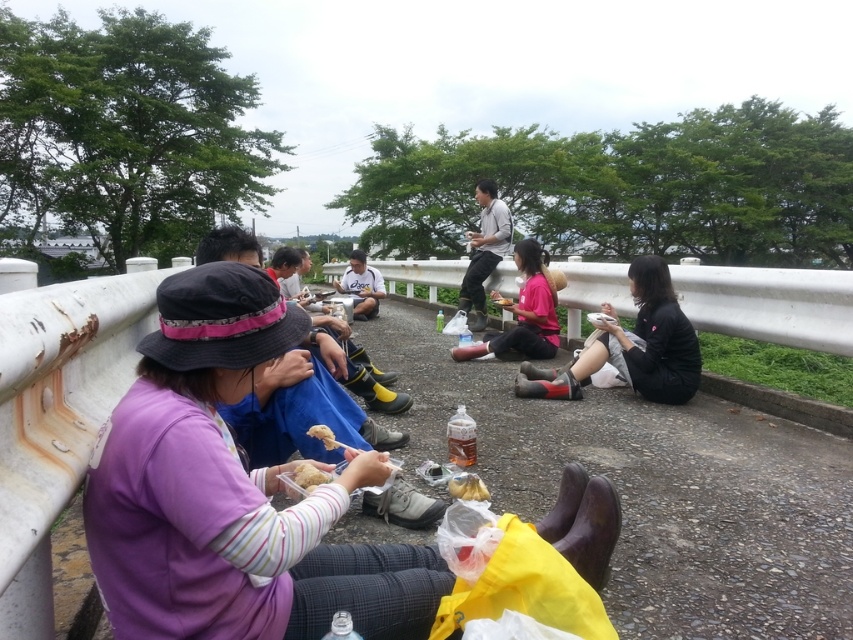
Question: Can you confirm if black matte sneakers at lower right is wider than yellow matte bread at lower center?

Choices:
 (A) no
 (B) yes

Answer: (B)

Question: Which point is farther to the camera?

Choices:
 (A) light brown leather jacket at center
 (B) yellow matte bread at lower center
 (C) yellow matte plate at center
 (D) black matte sneakers at lower right

Answer: (A)

Question: Can you confirm if purple fabric hat at left is positioned below yellow matte bread at lower center?

Choices:
 (A) no
 (B) yes

Answer: (A)

Question: Which point is farther from the camera taking this photo?

Choices:
 (A) (463, 497)
 (B) (502, 332)
 (C) (328, 429)

Answer: (B)

Question: Can you confirm if yellow paper bag at center is positioned below yellow matte bread at lower center?

Choices:
 (A) yes
 (B) no

Answer: (A)

Question: Which point appears farthest from the camera in this image?

Choices:
 (A) (505, 305)
 (B) (332, 440)
 (C) (492, 266)
 (D) (463, 472)

Answer: (C)